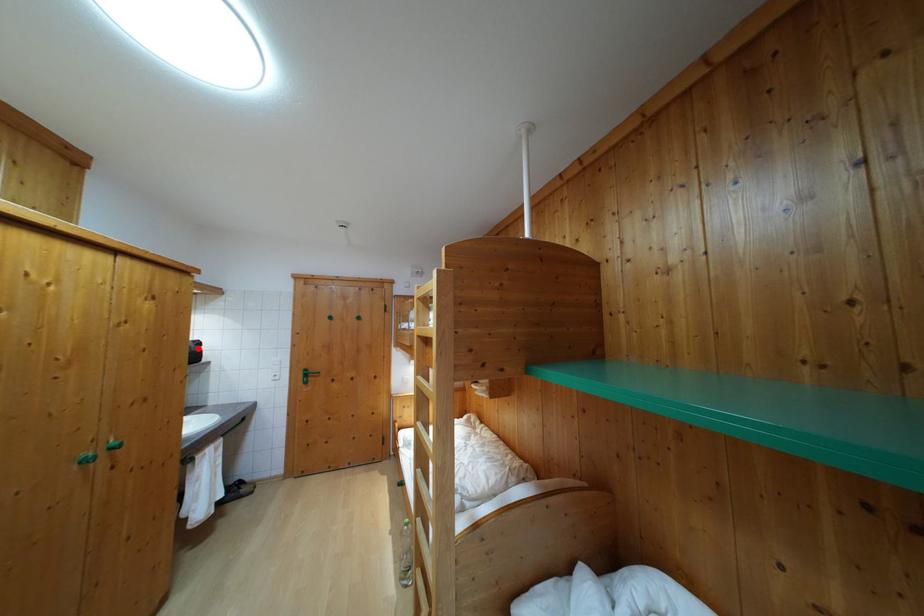
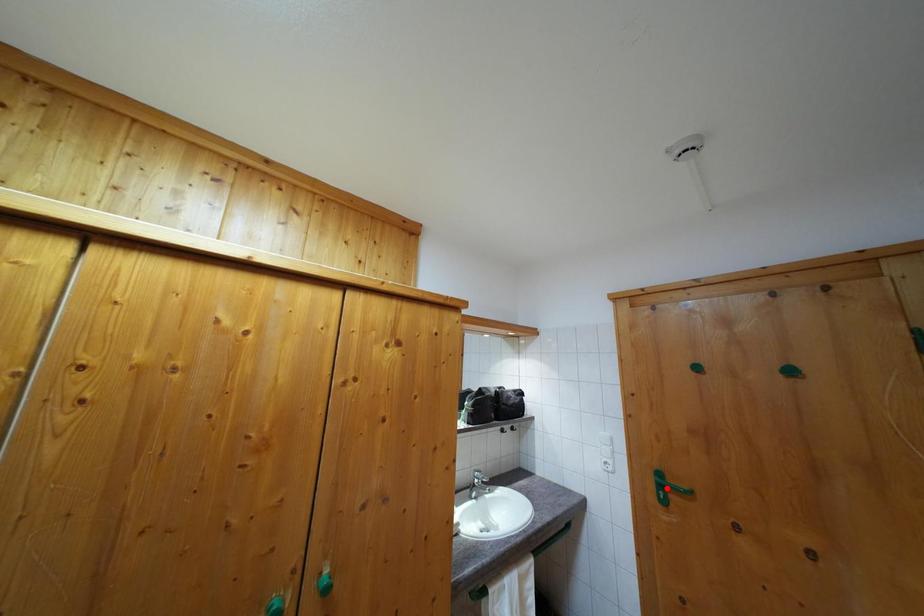
I am providing you with two images of the same scene from different viewpoints. A red point is marked on the first image and another point is marked on the second image. Is the marked point in image1 the same physical position as the marked point in image2?

No